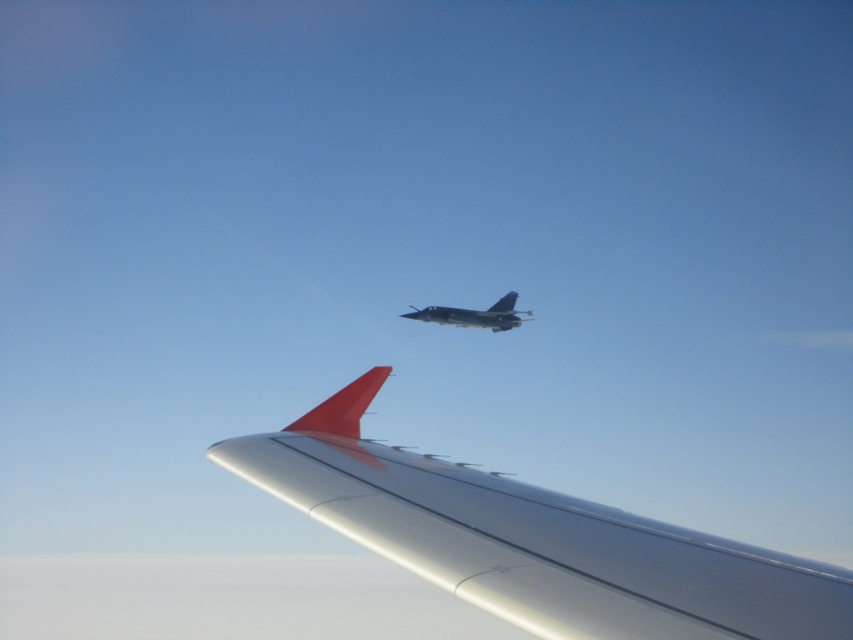
You are a pilot in the aircraft with the silver metallic wing at upper center. You notice another shiny metallic jet at center flying above you. Based on the scene, which object is taller?

The silver metallic wing at upper center is not as tall as the shiny metallic jet at center, so the shiny metallic jet at center is taller.

You are a pilot in an aircraft and notice two metallic objects in your view. The silver metallic wing at upper center and the shiny metallic jet at center. Which object is closer to your aircraft based on their positions?

Answer: The silver metallic wing at upper center is positioned under the shiny metallic jet at center, so the shiny metallic jet at center is closer to your aircraft since it is above the wing.